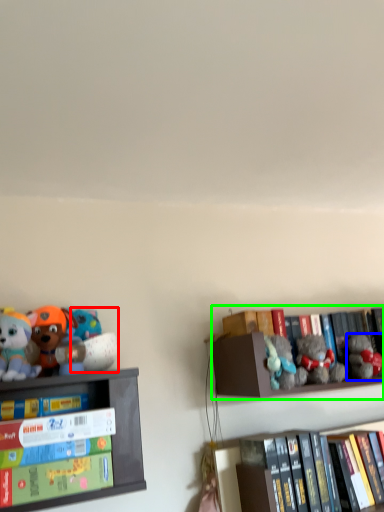
Question: Considering the real-world distances, which object is closest to toy (highlighted by a red box)? toy (highlighted by a blue box) or shelf (highlighted by a green box).

Choices:
 (A) toy
 (B) shelf

Answer: (B)